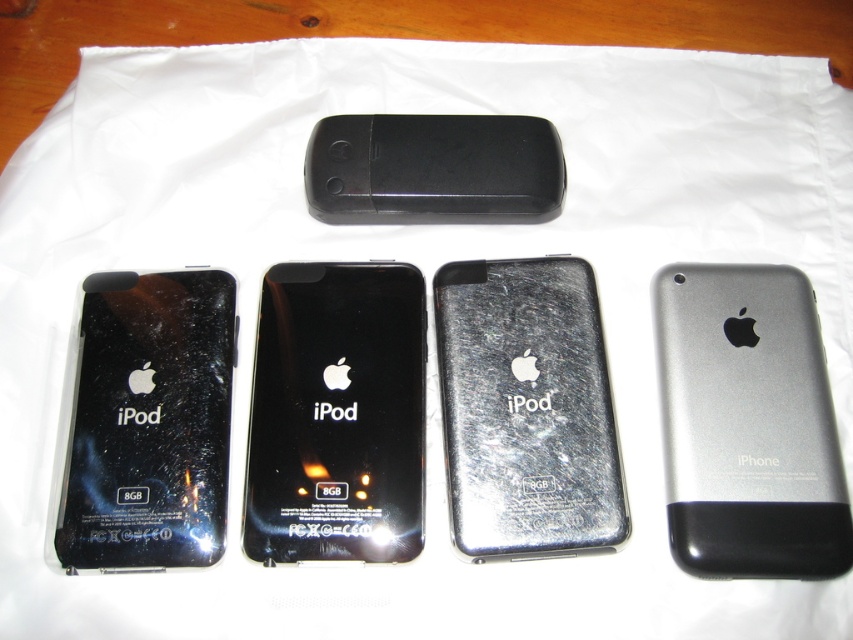
Question: Which object is positioned closest to the black matte/soft touch phone at center?

Choices:
 (A) satin silver iphone at upper right
 (B) black glossy ipod at center

Answer: (B)

Question: Where is satin silver iphone at upper right located in relation to black glossy ipod at center in the image?

Choices:
 (A) left
 (B) right

Answer: (B)

Question: Which object is positioned farthest from the black glossy ipod at center?

Choices:
 (A) black glossy ipod at left
 (B) black matte/soft touch phone at center

Answer: (B)

Question: Can you confirm if satin silver iphone at upper right is bigger than metallic silver ipod at center?

Choices:
 (A) yes
 (B) no

Answer: (A)

Question: From the image, what is the correct spatial relationship of satin silver iphone at upper right in relation to black glossy ipod at center?

Choices:
 (A) right
 (B) left

Answer: (A)

Question: Which point is closer to the camera?

Choices:
 (A) (473, 140)
 (B) (595, 346)
 (C) (750, 333)
 (D) (148, 518)

Answer: (D)